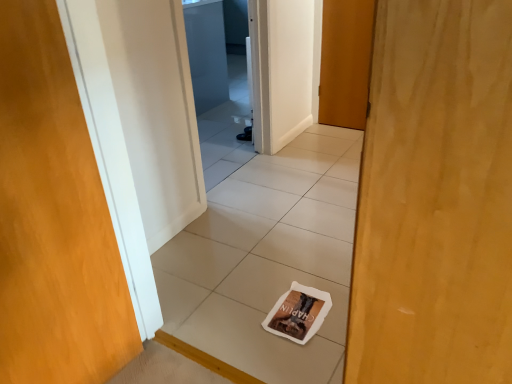
In order to click on vacant area situated below brown paper magazine at center (from a real-world perspective) in this screenshot , I will do `click(297, 306)`.